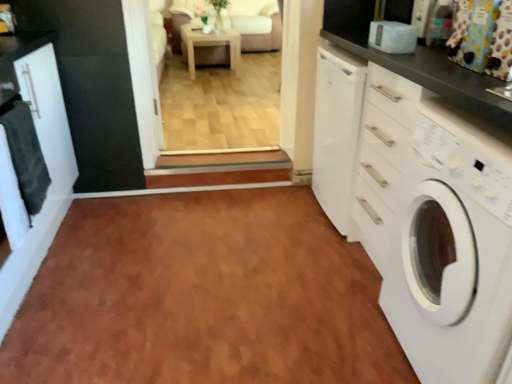
This screenshot has width=512, height=384. What do you see at coordinates (453, 249) in the screenshot? I see `white glossy washing machine at right` at bounding box center [453, 249].

Where is `white glossy cabinet at left`? The height and width of the screenshot is (384, 512). white glossy cabinet at left is located at coordinates (47, 168).

The image size is (512, 384). What do you see at coordinates (209, 46) in the screenshot?
I see `light brown wooden table at center` at bounding box center [209, 46].

What are the coordinates of `white glossy washing machine at right` in the screenshot? It's located at (453, 249).

Can you confirm if dark gray towel at left is positioned to the right of brown laminate floor at center?

No.

Who is bigger, dark gray towel at left or brown laminate floor at center?

brown laminate floor at center is bigger.

Considering the sizes of objects dark gray towel at left and brown laminate floor at center in the image provided, who is taller, dark gray towel at left or brown laminate floor at center?

dark gray towel at left is taller.

Between dark gray towel at left and brown laminate floor at center, which one has smaller width?

dark gray towel at left is thinner.

Based on the photo, based on their sizes in the image, would you say brown laminate floor at center is bigger or smaller than dark gray towel at left?

brown laminate floor at center is bigger than dark gray towel at left.

Is brown laminate floor at center directly adjacent to dark gray towel at left?

No, brown laminate floor at center is not making contact with dark gray towel at left.

Which object is positioned more to the left, brown laminate floor at center or dark gray towel at left?

dark gray towel at left is more to the left.

Considering the sizes of brown laminate floor at center and dark gray towel at left in the image, is brown laminate floor at center taller or shorter than dark gray towel at left?

In the image, brown laminate floor at center appears to be shorter than dark gray towel at left.

Are light brown wooden table at center and white glossy cabinet at left beside each other?

No, light brown wooden table at center is not next to white glossy cabinet at left.

Visually, is light brown wooden table at center positioned to the left or to the right of white glossy cabinet at left?

light brown wooden table at center is to the right of white glossy cabinet at left.

Does light brown wooden table at center have a smaller size compared to white glossy cabinet at left?

Yes, light brown wooden table at center is smaller than white glossy cabinet at left.

Considering the positions of points (189, 62) and (53, 64), is point (189, 62) farther from camera compared to point (53, 64)?

That is True.

From a real-world perspective, which is physically below, multicolored fabric curtain at upper right or white glossy cabinet at left?

From a 3D spatial view, white glossy cabinet at left is below.

Is multicolored fabric curtain at upper right turned away from white glossy cabinet at left?

multicolored fabric curtain at upper right is not turned away from white glossy cabinet at left.

From the image's perspective, which is above, multicolored fabric curtain at upper right or white glossy cabinet at left?

multicolored fabric curtain at upper right.

Which object is more forward, multicolored fabric curtain at upper right or white glossy cabinet at left?

white glossy cabinet at left is more forward.

Does brown laminate floor at center touch light brown wooden table at center?

No, brown laminate floor at center is not touching light brown wooden table at center.

From the image's perspective, is brown laminate floor at center located beneath light brown wooden table at center?

Correct, brown laminate floor at center appears lower than light brown wooden table at center in the image.

Measure the distance between brown laminate floor at center and light brown wooden table at center.

brown laminate floor at center is 3.42 meters from light brown wooden table at center.

Considering the positions of points (250, 288) and (191, 75), is point (250, 288) farther from camera compared to point (191, 75)?

No, (250, 288) is closer to viewer.

Considering the relative sizes of light brown wooden table at center and brown laminate floor at center in the image provided, is light brown wooden table at center taller than brown laminate floor at center?

Indeed, light brown wooden table at center has a greater height compared to brown laminate floor at center.

From a real-world perspective, is light brown wooden table at center located higher than brown laminate floor at center?

Yes, from a real-world perspective, light brown wooden table at center is over brown laminate floor at center

Is the depth of light brown wooden table at center greater than that of brown laminate floor at center?

Yes.

Which is in front, brown laminate floor at center or multicolored fabric curtain at upper right?

multicolored fabric curtain at upper right is closer to the camera.

From the image's perspective, which one is positioned higher, brown laminate floor at center or multicolored fabric curtain at upper right?

multicolored fabric curtain at upper right, from the image's perspective.

You are a GUI agent. You are given a task and a screenshot of the screen. Output one action in this format:
    pyautogui.click(x=<x>, y=<y>)
    Task: Click on the plain behind the multicolored fabric curtain at upper right
    
    Given the screenshot: What is the action you would take?
    pyautogui.click(x=203, y=296)

Which is less distant, (112, 297) or (460, 48)?

Point (112, 297).

The image size is (512, 384). I want to click on plain in front of the dark gray towel at left, so click(x=203, y=296).

Identify the location of laundry located above the brown laminate floor at center (from the image's perspective). (25, 159).

Estimate the real-world distances between objects in this image. Which object is further from light brown wooden table at center, dark gray towel at left or brown laminate floor at center?

The object further to light brown wooden table at center is dark gray towel at left.

When comparing their distances from light brown wooden table at center, does white glossy cabinet at left or brown laminate floor at center seem further?

Among the two, brown laminate floor at center is located further to light brown wooden table at center.

Looking at the image, which one is located further to multicolored fabric curtain at upper right, white glossy washing machine at right or light brown wooden table at center?

The object further to multicolored fabric curtain at upper right is light brown wooden table at center.

Looking at the image, which one is located closer to brown laminate floor at center, white glossy washing machine at right or light brown wooden table at center?

white glossy washing machine at right is positioned closer to the anchor brown laminate floor at center.

When comparing their distances from dark gray towel at left, does white glossy cabinet at left or light brown wooden table at center seem further?

Among the two, light brown wooden table at center is located further to dark gray towel at left.

Looking at this image, from the image, which object appears to be farther from white glossy washing machine at right, white glossy cabinet at left or brown laminate floor at center?

white glossy cabinet at left is further to white glossy washing machine at right.

Considering their positions, is dark gray towel at left positioned further to multicolored fabric curtain at upper right than white glossy washing machine at right?

dark gray towel at left lies further to multicolored fabric curtain at upper right than the other object.

From the image, which object appears to be farther from light brown wooden table at center, multicolored fabric curtain at upper right or dark gray towel at left?

multicolored fabric curtain at upper right is further to light brown wooden table at center.

Locate an element on the screen. The height and width of the screenshot is (384, 512). curtain between dark gray towel at left and white glossy washing machine at right in the horizontal direction is located at coordinates (x=482, y=36).

Identify the location of plain between white glossy cabinet at left and multicolored fabric curtain at upper right in the horizontal direction. Image resolution: width=512 pixels, height=384 pixels. (203, 296).

The height and width of the screenshot is (384, 512). In order to click on plain between white glossy cabinet at left and light brown wooden table at center in the front-back direction in this screenshot , I will do `click(203, 296)`.

Find the location of a particular element. The image size is (512, 384). laundry between white glossy washing machine at right and light brown wooden table at center from front to back is located at coordinates (25, 159).